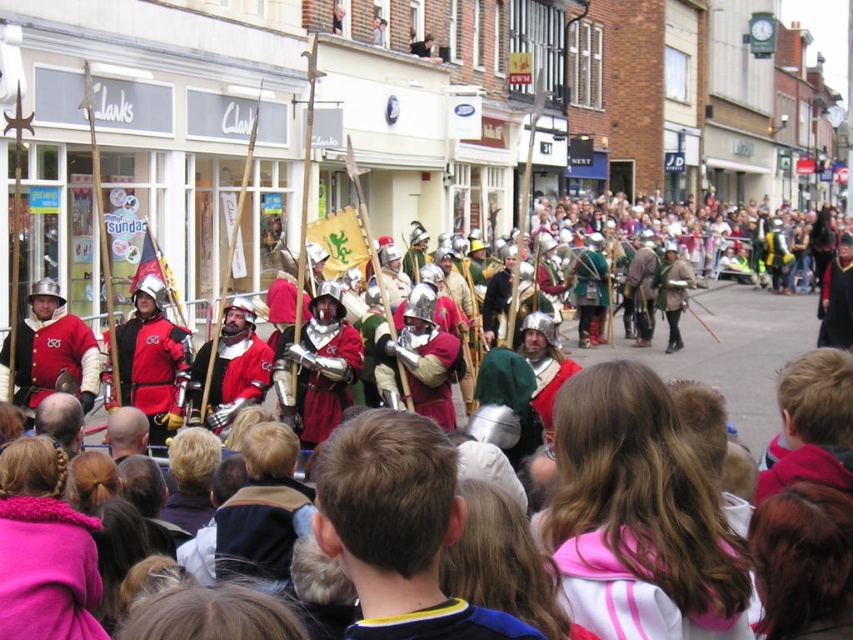
Between dark brown hair at center and metallic armor at center, which one has less height?

dark brown hair at center

Between dark brown hair at center and metallic armor at center, which one is positioned lower?

Positioned lower is dark brown hair at center.

Where is `dark brown hair at center`? The image size is (853, 640). dark brown hair at center is located at coordinates (397, 529).

Is metallic armor at center taller than shiny silver armor at center?

Yes, metallic armor at center is taller than shiny silver armor at center.

Can you confirm if metallic armor at center is positioned above shiny silver armor at center?

Correct, metallic armor at center is located above shiny silver armor at center.

Locate an element on the screen. The height and width of the screenshot is (640, 853). metallic armor at center is located at coordinates (744, 355).

Does metallic armor at center have a larger size compared to pink fabric jacket at center?

Correct, metallic armor at center is larger in size than pink fabric jacket at center.

Which is behind, point (720, 381) or point (643, 602)?

Positioned behind is point (720, 381).

Who is more distant from viewer, [802,305] or [596,545]?

The point [802,305] is more distant.

You are a GUI agent. You are given a task and a screenshot of the screen. Output one action in this format:
    pyautogui.click(x=<x>, y=<y>)
    Task: Click on the metallic armor at center
    The image size is (853, 640).
    Given the screenshot: What is the action you would take?
    pyautogui.click(x=744, y=355)